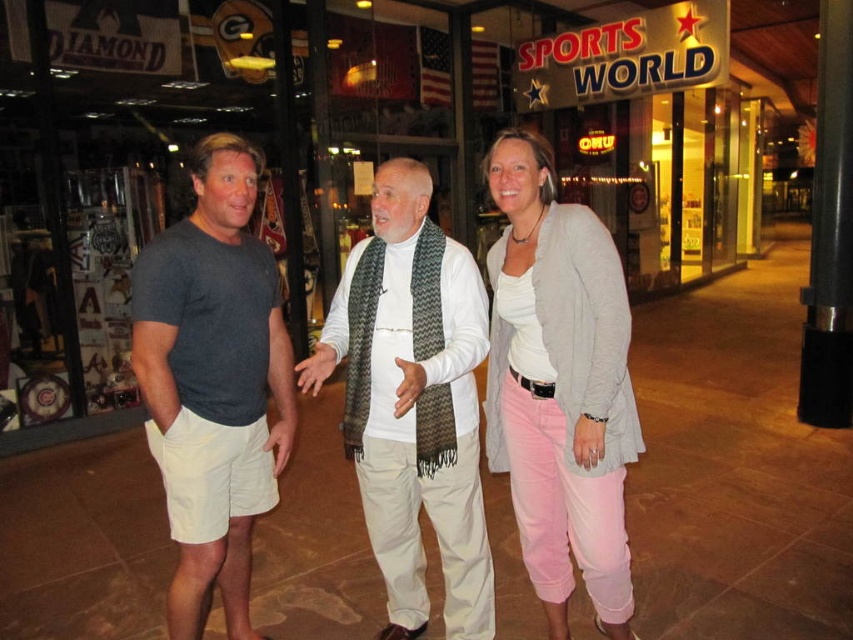
Question: Estimate the real-world distances between objects in this image. Which object is farther from the light gray textured cardigan at center?

Choices:
 (A) gray cotton cardigan at center
 (B) white woven scarf at center
 (C) dark gray t-shirt at left

Answer: (C)

Question: Among these objects, which one is nearest to the camera?

Choices:
 (A) dark gray t-shirt at left
 (B) white woven scarf at center
 (C) light gray textured cardigan at center

Answer: (B)

Question: Can you confirm if light gray textured cardigan at center is smaller than white woven scarf at center?

Choices:
 (A) no
 (B) yes

Answer: (B)

Question: Which object appears closest to the camera in this image?

Choices:
 (A) dark gray t-shirt at left
 (B) gray cotton cardigan at center
 (C) light gray textured cardigan at center
 (D) white woven scarf at center

Answer: (D)

Question: Considering the relative positions of light gray textured cardigan at center and white woven scarf at center in the image provided, where is light gray textured cardigan at center located with respect to white woven scarf at center?

Choices:
 (A) right
 (B) left

Answer: (A)

Question: Is gray cotton cardigan at center thinner than dark gray t-shirt at left?

Choices:
 (A) yes
 (B) no

Answer: (B)